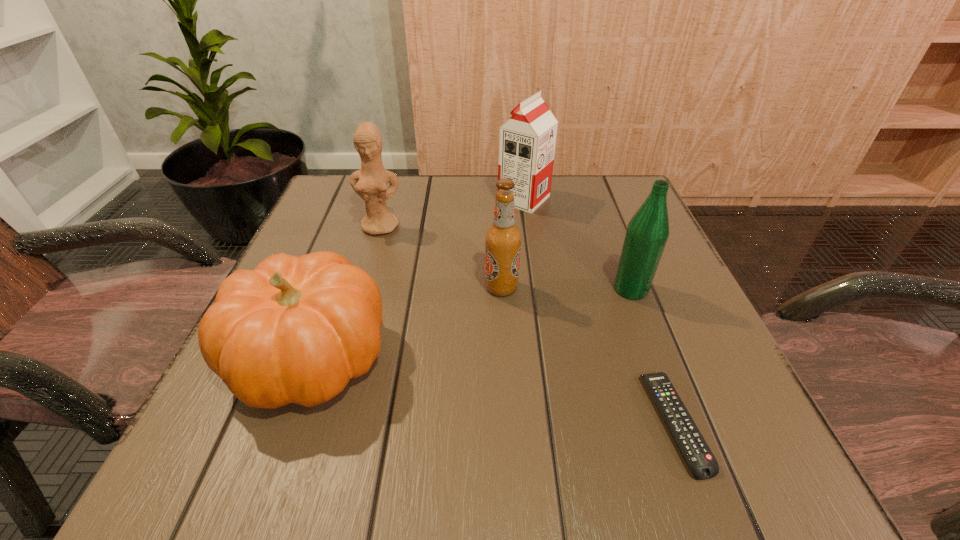
Locate an element on the screen. free space that satisfies the following two spatial constraints: 1. on the back side of the second shortest object; 2. on the left side of the farthest object is located at coordinates (368, 199).

Find the location of a particular element. The width and height of the screenshot is (960, 540). free spot that satisfies the following two spatial constraints: 1. on the front-facing side of the bottle; 2. on the right side of the figurine is located at coordinates (362, 289).

Where is `free space in the image that satisfies the following two spatial constraints: 1. on the front-facing side of the figurine; 2. on the left side of the remote control`? free space in the image that satisfies the following two spatial constraints: 1. on the front-facing side of the figurine; 2. on the left side of the remote control is located at coordinates (323, 422).

The height and width of the screenshot is (540, 960). I want to click on vacant space that satisfies the following two spatial constraints: 1. on the back side of the bottle; 2. on the left side of the second shortest object, so click(x=335, y=289).

At what (x,y) coordinates should I click in order to perform the action: click on free spot that satisfies the following two spatial constraints: 1. on the back side of the bottle; 2. on the right side of the fifth tallest object. Please return your answer as a coordinate pair (x, y). The width and height of the screenshot is (960, 540). Looking at the image, I should click on (335, 289).

In order to click on vacant region that satisfies the following two spatial constraints: 1. on the front label of the beer bottle; 2. on the back side of the bottle in this screenshot , I will do `click(501, 289)`.

At what (x,y) coordinates should I click in order to perform the action: click on free location that satisfies the following two spatial constraints: 1. on the front-facing side of the figurine; 2. on the right side of the remote control. Please return your answer as a coordinate pair (x, y). Looking at the image, I should click on (323, 422).

Identify the location of free space that satisfies the following two spatial constraints: 1. on the front-facing side of the bottle; 2. on the left side of the figurine. (362, 289).

This screenshot has width=960, height=540. I want to click on free spot that satisfies the following two spatial constraints: 1. on the front-facing side of the figurine; 2. on the right side of the remote control, so click(323, 422).